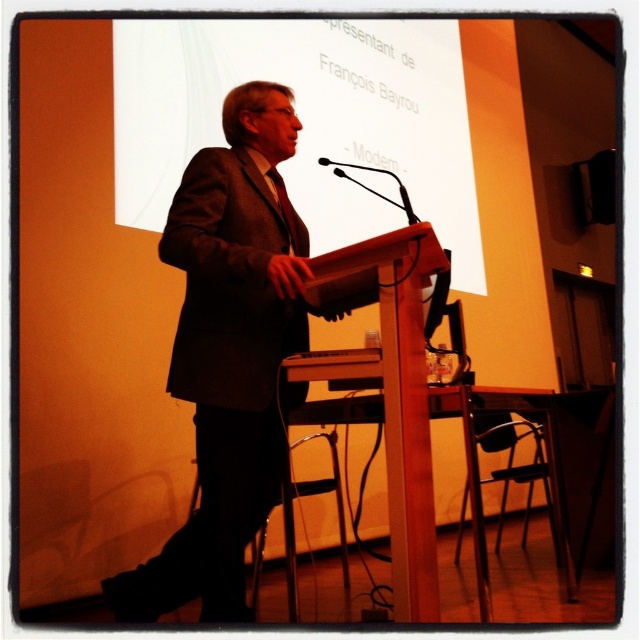
Which is more to the right, white paper at upper center or dark brown suit at center?

Positioned to the right is white paper at upper center.

Who is taller, white paper at upper center or dark brown suit at center?

white paper at upper center is taller.

This screenshot has height=640, width=640. Describe the element at coordinates (305, 120) in the screenshot. I see `white paper at upper center` at that location.

Locate an element on the screen. white paper at upper center is located at coordinates (305, 120).

Between white paper at upper center and black matte microphone at center, which one has more height?

white paper at upper center is taller.

Is white paper at upper center positioned behind black matte microphone at center?

Yes, white paper at upper center is further from the viewer.

Between point (348, 92) and point (369, 166), which one is positioned behind?

The point (348, 92) is more distant.

What are the coordinates of `white paper at upper center` in the screenshot? It's located at (305, 120).

Is dark brown suit at center bigger than black matte microphone at center?

Actually, dark brown suit at center might be smaller than black matte microphone at center.

Is dark brown suit at center shorter than black matte microphone at center?

No.

Between point (256, 307) and point (390, 172), which one is positioned in front?

Positioned in front is point (256, 307).

This screenshot has width=640, height=640. In order to click on dark brown suit at center in this screenshot , I will do `click(228, 353)`.